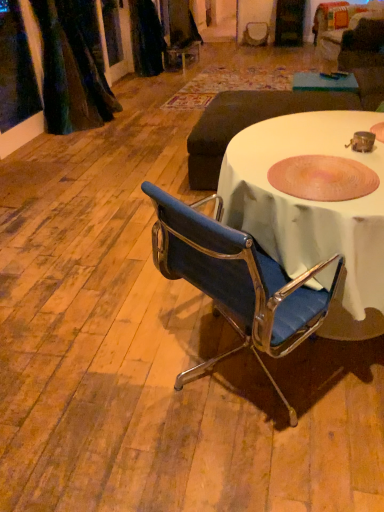
Question: Does blue fabric chair at center have a lesser width compared to pink textured bowl at center?

Choices:
 (A) no
 (B) yes

Answer: (A)

Question: Is blue fabric chair at center further to the viewer compared to pink textured bowl at center?

Choices:
 (A) yes
 (B) no

Answer: (B)

Question: Is blue fabric chair at center positioned with its back to pink textured bowl at center?

Choices:
 (A) no
 (B) yes

Answer: (A)

Question: Is blue fabric chair at center not within pink textured bowl at center?

Choices:
 (A) no
 (B) yes

Answer: (B)

Question: Considering the relative sizes of blue fabric chair at center and pink textured bowl at center in the image provided, is blue fabric chair at center bigger than pink textured bowl at center?

Choices:
 (A) yes
 (B) no

Answer: (A)

Question: Does blue fabric chair at center have a lesser height compared to pink textured bowl at center?

Choices:
 (A) yes
 (B) no

Answer: (B)

Question: From the image's perspective, is pink textured bowl at center beneath dark gray fabric ottoman at center?

Choices:
 (A) yes
 (B) no

Answer: (A)

Question: Is pink textured bowl at center outside of dark gray fabric ottoman at center?

Choices:
 (A) no
 (B) yes

Answer: (B)

Question: Can you confirm if pink textured bowl at center is positioned to the right of dark gray fabric ottoman at center?

Choices:
 (A) yes
 (B) no

Answer: (B)

Question: Is the surface of pink textured bowl at center in direct contact with dark gray fabric ottoman at center?

Choices:
 (A) no
 (B) yes

Answer: (A)

Question: Can you confirm if pink textured bowl at center is positioned to the left of dark gray fabric ottoman at center?

Choices:
 (A) no
 (B) yes

Answer: (B)

Question: Is pink textured bowl at center positioned before dark gray fabric ottoman at center?

Choices:
 (A) yes
 (B) no

Answer: (A)

Question: Does velvet dark green curtain at upper left have a larger size compared to dark gray fabric ottoman at center?

Choices:
 (A) no
 (B) yes

Answer: (A)